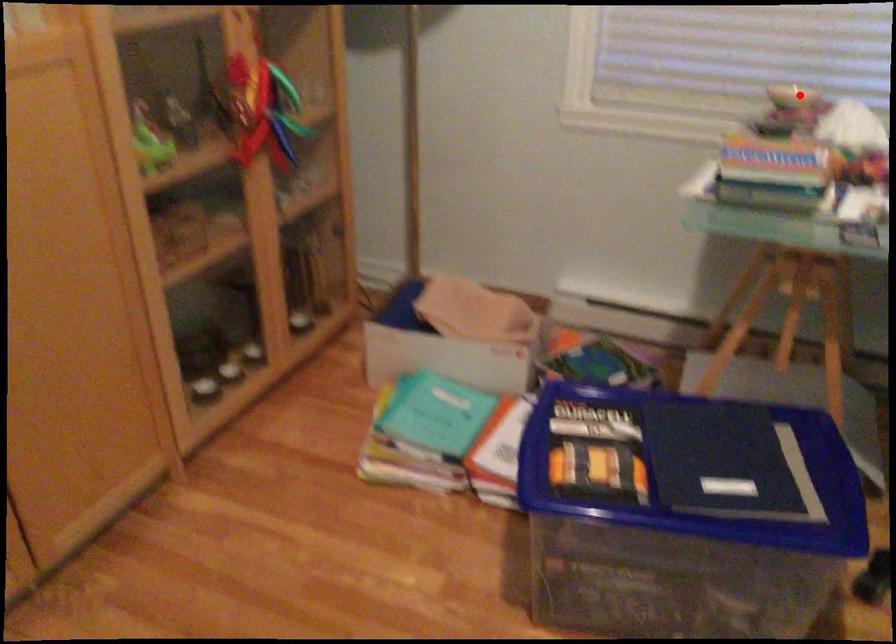
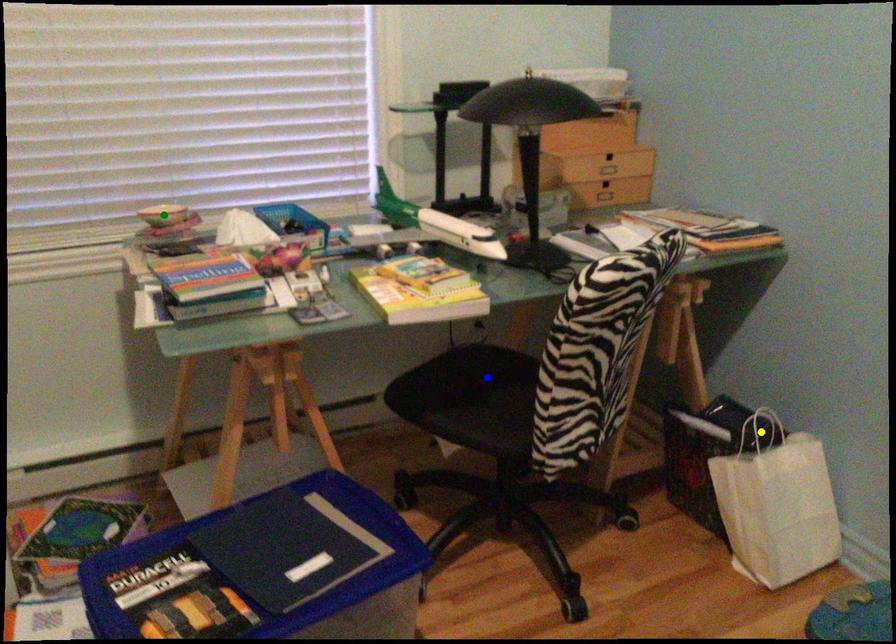
Question: I am providing you with two images of the same scene from different viewpoints. A red point is marked on the first image. You are given multiple points on the second image. Which point in image 2 represents the same 3d spot as the red point in image 1?

Choices:
 (A) blue point
 (B) yellow point
 (C) green point

Answer: (C)